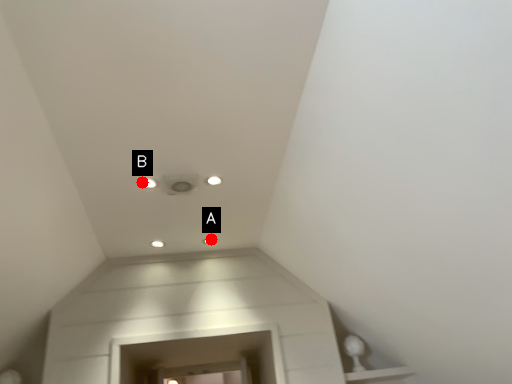
Question: Two points are circled on the image, labeled by A and B beside each circle. Which point is closer to the camera taking this photo?

Choices:
 (A) A is closer
 (B) B is closer

Answer: (B)